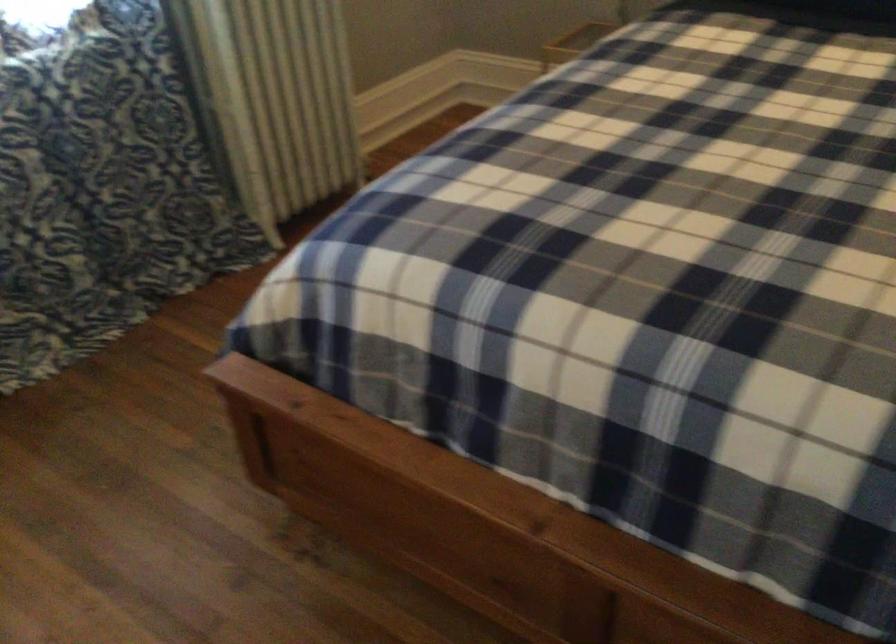
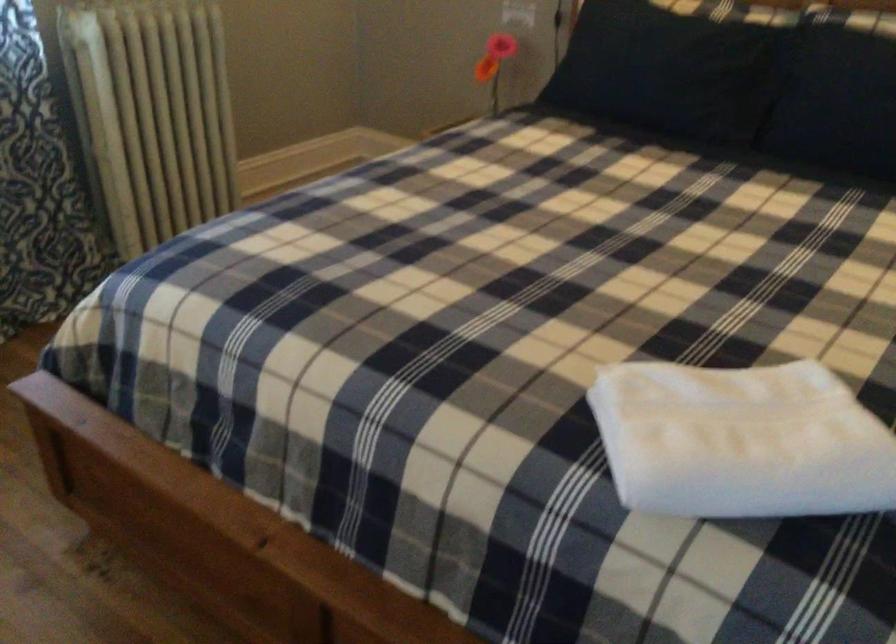
Question: The images are taken continuously from a first-person perspective. In which direction is your viewpoint rotating?

Choices:
 (A) Left
 (B) Right
 (C) Up
 (D) Down

Answer: (C)